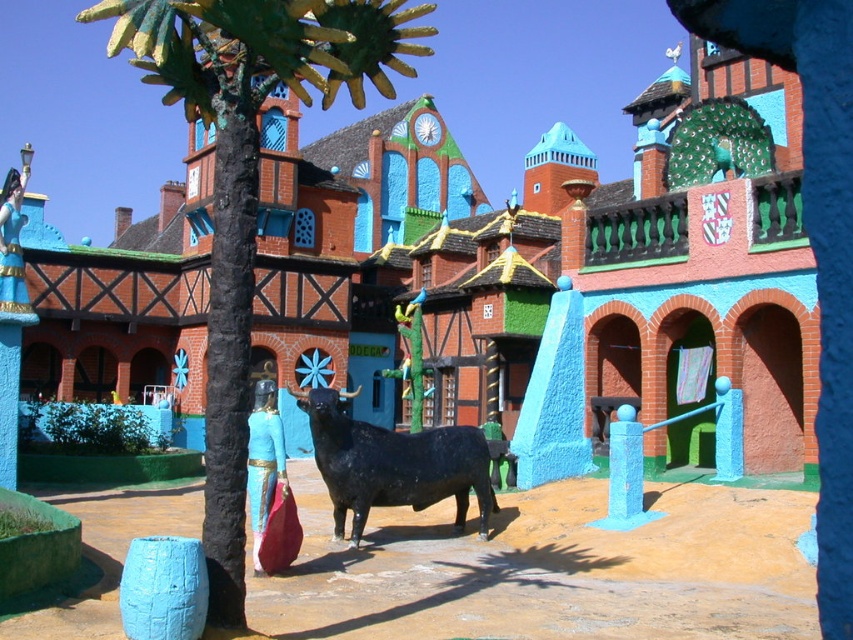
Question: Is green painted wood palm tree at center to the left of black matte bull at center from the viewer's perspective?

Choices:
 (A) no
 (B) yes

Answer: (B)

Question: Which object appears closest to the camera in this image?

Choices:
 (A) black matte bull at center
 (B) green painted wood palm tree at center

Answer: (B)

Question: Does green painted wood palm tree at center have a lesser width compared to black matte bull at center?

Choices:
 (A) yes
 (B) no

Answer: (B)

Question: Which object is closer to the camera taking this photo?

Choices:
 (A) green painted wood palm tree at center
 (B) black matte bull at center

Answer: (A)

Question: Can you confirm if green painted wood palm tree at center is wider than black matte bull at center?

Choices:
 (A) no
 (B) yes

Answer: (B)